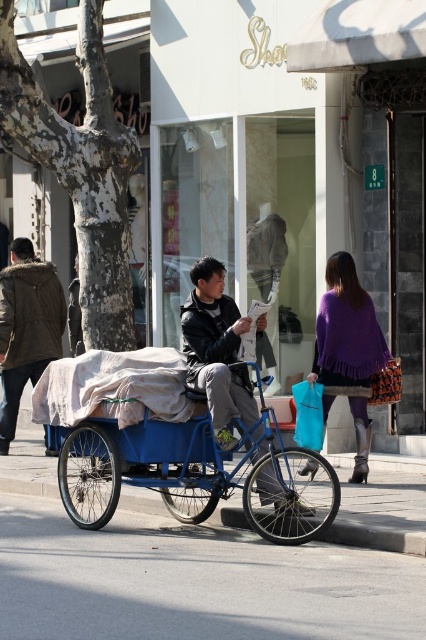
You are standing at the point labeled point (x=80, y=406) and want to walk to the point labeled point (x=374, y=358). Which direction should you turn to face the direction of your destination?

You should turn to face the direction towards point (x=374, y=358), which is behind point (x=80, y=406) according to their spatial relationship.